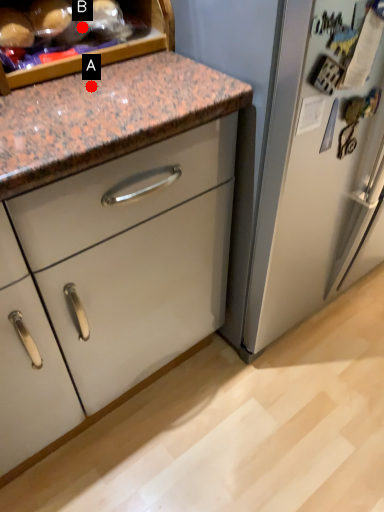
Question: Two points are circled on the image, labeled by A and B beside each circle. Among these points, which one is farthest from the camera?

Choices:
 (A) A is further
 (B) B is further

Answer: (B)